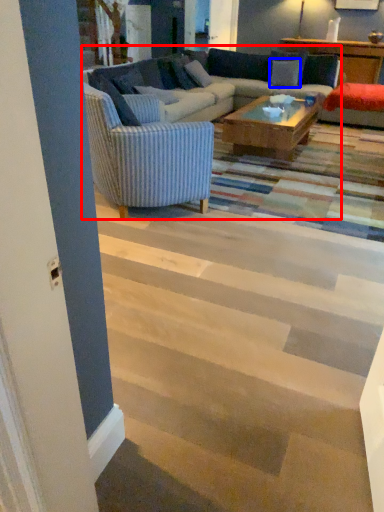
Question: Which point is closer to the camera, studio couch (highlighted by a red box) or pillow (highlighted by a blue box)?

Choices:
 (A) studio couch
 (B) pillow

Answer: (A)